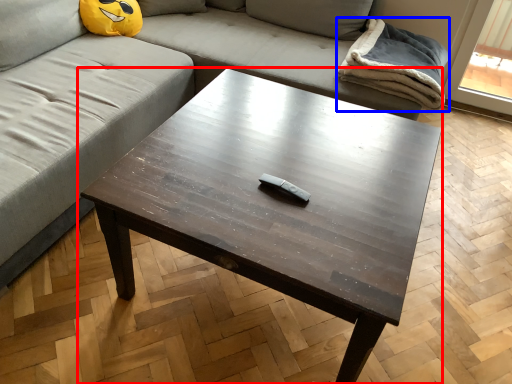
Question: Which object is further to the camera taking this photo, coffee table (highlighted by a red box) or blanket (highlighted by a blue box)?

Choices:
 (A) coffee table
 (B) blanket

Answer: (B)